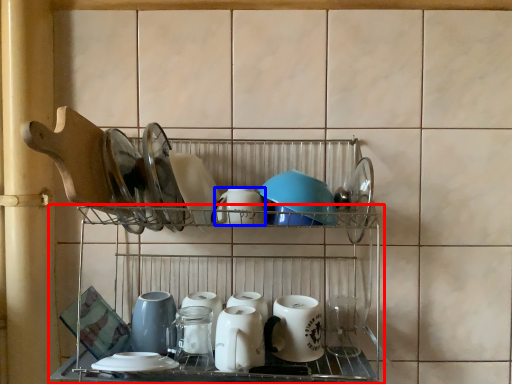
Question: Which of the following is the closest to the observer, shelf (highlighted by a red box) or tableware (highlighted by a blue box)?

Choices:
 (A) shelf
 (B) tableware

Answer: (A)